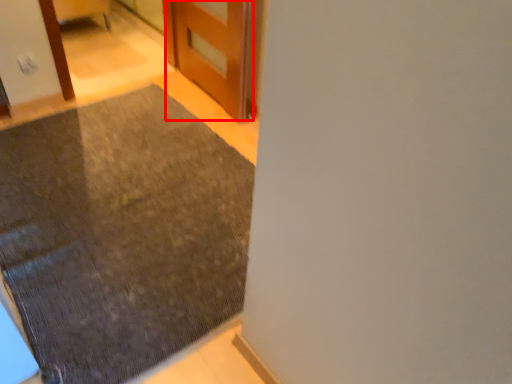
Question: Considering the relative positions of door (annotated by the red box) and mat in the image provided, where is door (annotated by the red box) located with respect to the staircase?

Choices:
 (A) right
 (B) left

Answer: (A)